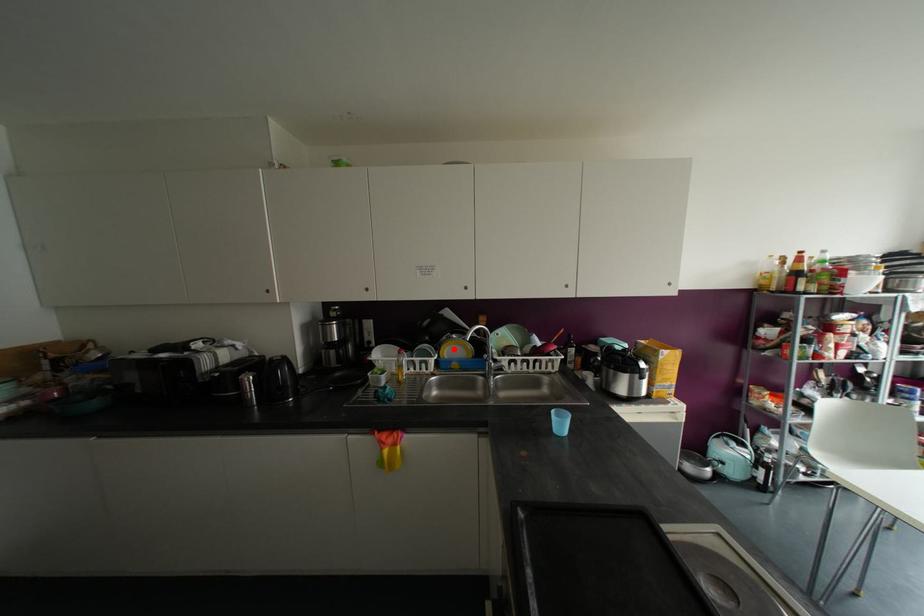
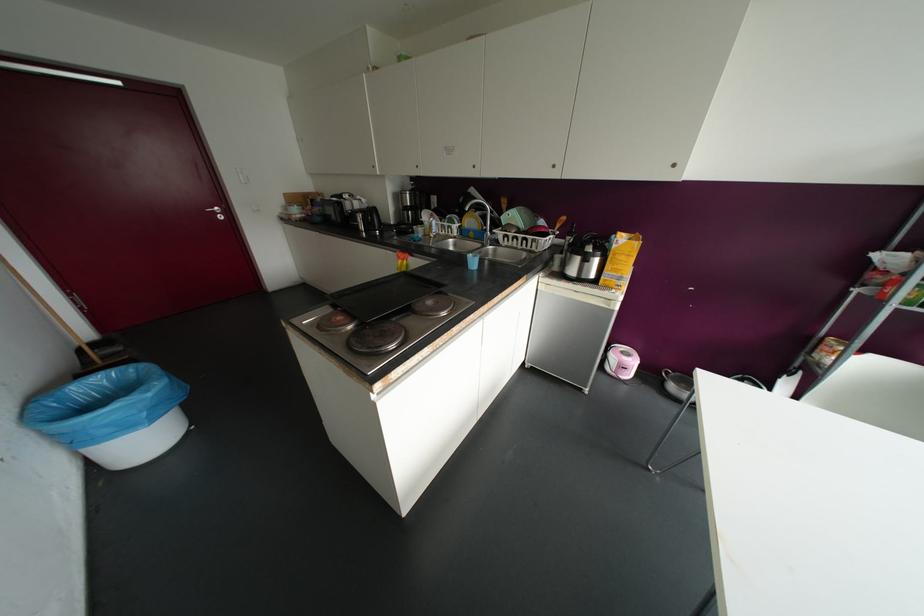
Locate, in the second image, the point that corresponds to the highlighted location in the first image.

(469, 221)